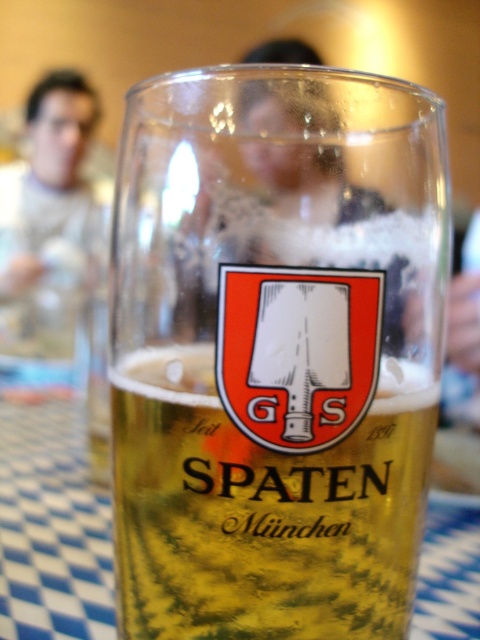
Is point (404, 540) positioned in front of point (267, 545)?

No, (404, 540) is behind (267, 545).

Who is lower down, transparent glass mug at center or translucent glass beer at center?

translucent glass beer at center is lower down.

This screenshot has height=640, width=480. Identify the location of transparent glass mug at center. click(x=275, y=349).

Identify the location of transparent glass mug at center. (275, 349).